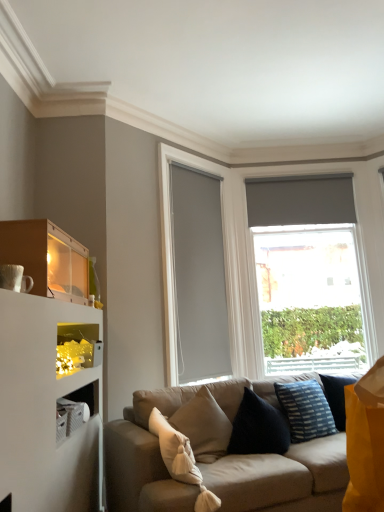
Question: Can you confirm if matte wood shelf at upper left is smaller than beige fabric couch at center?

Choices:
 (A) no
 (B) yes

Answer: (B)

Question: Is matte wood shelf at upper left positioned before beige fabric couch at center?

Choices:
 (A) yes
 (B) no

Answer: (B)

Question: Can you confirm if matte wood shelf at upper left is taller than beige fabric couch at center?

Choices:
 (A) yes
 (B) no

Answer: (B)

Question: Does matte wood shelf at upper left appear on the left side of beige fabric couch at center?

Choices:
 (A) no
 (B) yes

Answer: (B)

Question: Is matte wood shelf at upper left to the right of beige fabric couch at center from the viewer's perspective?

Choices:
 (A) yes
 (B) no

Answer: (B)

Question: Considering the relative positions of beige fabric couch at center and matte gray glass door at center in the image provided, is beige fabric couch at center to the left or to the right of matte gray glass door at center?

Choices:
 (A) left
 (B) right

Answer: (B)

Question: From the image's perspective, is beige fabric couch at center above or below matte gray glass door at center?

Choices:
 (A) above
 (B) below

Answer: (B)

Question: In terms of height, does beige fabric couch at center look taller or shorter compared to matte gray glass door at center?

Choices:
 (A) short
 (B) tall

Answer: (A)

Question: In the image, is beige fabric couch at center positioned in front of or behind matte gray glass door at center?

Choices:
 (A) front
 (B) behind

Answer: (A)

Question: Is blue striped fabric pillow at lower right, arranged as the 1th pillow when viewed from the right, in front of or behind iridescent plastic lights at lower left in the image?

Choices:
 (A) behind
 (B) front

Answer: (A)

Question: Would you say blue striped fabric pillow at lower right, the 2th pillow in the left-to-right sequence, is to the left or to the right of iridescent plastic lights at lower left in the picture?

Choices:
 (A) right
 (B) left

Answer: (A)

Question: Is blue striped fabric pillow at lower right, arranged as the 2th pillow when viewed from the front, taller or shorter than iridescent plastic lights at lower left?

Choices:
 (A) short
 (B) tall

Answer: (B)

Question: Is blue striped fabric pillow at lower right, arranged as the 2th pillow when viewed from the front, spatially inside iridescent plastic lights at lower left, or outside of it?

Choices:
 (A) outside
 (B) inside

Answer: (A)

Question: Relative to matte gray roller blind at right, is iridescent plastic lights at lower left in front or behind?

Choices:
 (A) behind
 (B) front

Answer: (B)

Question: From their relative heights in the image, would you say iridescent plastic lights at lower left is taller or shorter than matte gray roller blind at right?

Choices:
 (A) short
 (B) tall

Answer: (A)